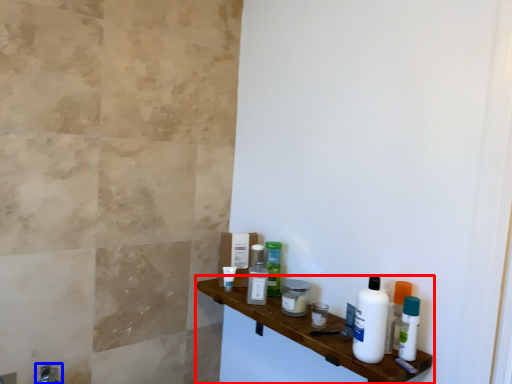
Question: Which object appears farthest to the camera in this image, shelf (highlighted by a red box) or faucet (highlighted by a blue box)?

Choices:
 (A) shelf
 (B) faucet

Answer: (B)